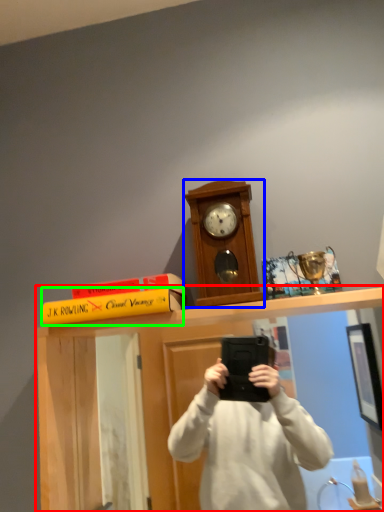
Question: Which is farther away from vanity (highlighted by a red box)? clock (highlighted by a blue box) or book (highlighted by a green box)?

Choices:
 (A) clock
 (B) book

Answer: (A)